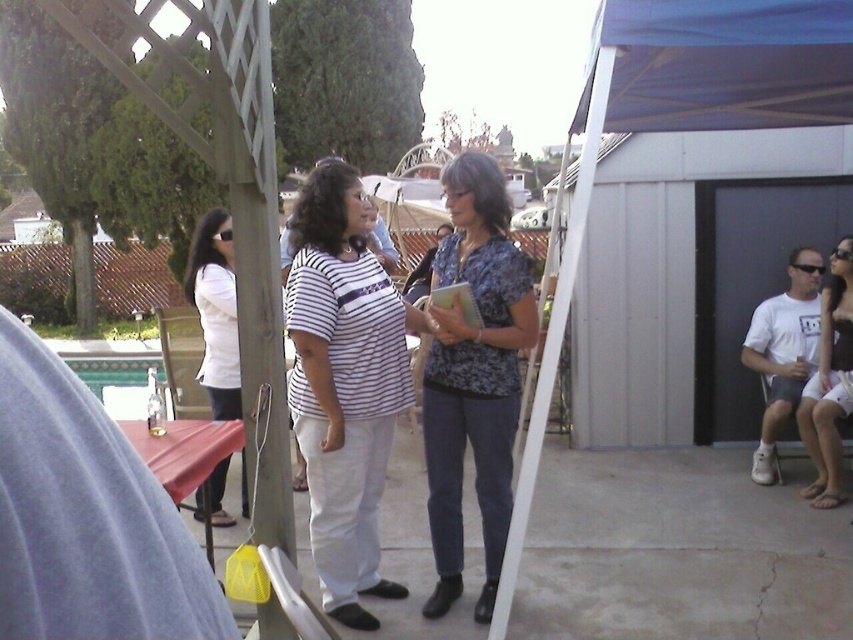
Is white striped shirt at center taller than white cotton shorts at lower right?

Yes, white striped shirt at center is taller than white cotton shorts at lower right.

Can you confirm if white striped shirt at center is positioned above white cotton shorts at lower right?

No.

The height and width of the screenshot is (640, 853). In order to click on white striped shirt at center in this screenshot , I will do `click(344, 384)`.

Does blue printed blouse at center have a smaller size compared to blue fabric canopy at upper right?

Incorrect, blue printed blouse at center is not smaller in size than blue fabric canopy at upper right.

Can you confirm if blue printed blouse at center is shorter than blue fabric canopy at upper right?

Incorrect, blue printed blouse at center's height does not fall short of blue fabric canopy at upper right's.

What do you see at coordinates (474, 376) in the screenshot?
I see `blue printed blouse at center` at bounding box center [474, 376].

Find the location of a particular element. The image size is (853, 640). blue printed blouse at center is located at coordinates (474, 376).

Is white matte shirt at left bigger than white cotton shorts at lower right?

Indeed, white matte shirt at left has a larger size compared to white cotton shorts at lower right.

Which of these two, white matte shirt at left or white cotton shorts at lower right, stands taller?

With more height is white cotton shorts at lower right.

Where is `white matte shirt at left`? Image resolution: width=853 pixels, height=640 pixels. white matte shirt at left is located at coordinates (215, 310).